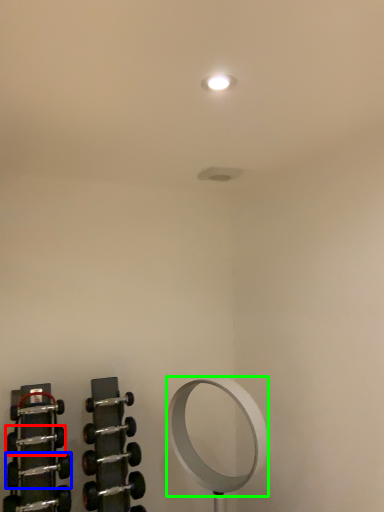
Question: Which object is the farthest from dumbbell (highlighted by a red box)? Choose among these: dumbbell (highlighted by a blue box) or mirror (highlighted by a green box).

Choices:
 (A) dumbbell
 (B) mirror

Answer: (B)